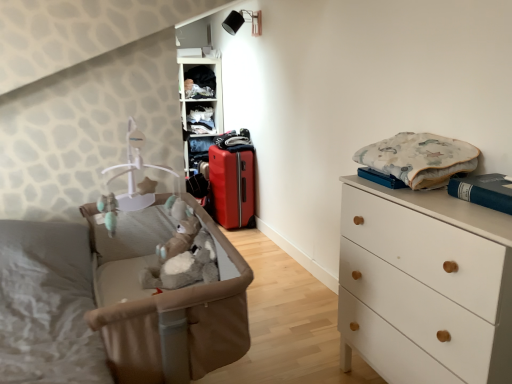
Question: Does point (181, 61) appear closer or farther from the camera than point (133, 142)?

Choices:
 (A) farther
 (B) closer

Answer: (A)

Question: From a real-world perspective, is matte plastic shelf at upper center, which is the second shelf in top-to-bottom order, positioned above or below brown fabric infant bed at left?

Choices:
 (A) above
 (B) below

Answer: (A)

Question: Estimate the real-world distances between objects in this image. Which object is farther from the white matte chest of drawers at right?

Choices:
 (A) matte plastic shelves at upper center, the 1th shelf positioned from the top
 (B) brown fabric infant bed at left
 (C) fluffy cotton blanket at upper right, the 2th clothing in the left-to-right sequence
 (D) dark blue fabric at upper center, acting as the second clothing starting from the right
 (E) matte red suitcase at center

Answer: (D)

Question: Considering the real-world distances, which object is closest to the matte plastic shelves at upper center, which is the second shelf from bottom to top?

Choices:
 (A) matte plastic shelf at upper center, which is the second shelf in top-to-bottom order
 (B) brown fabric infant bed at left
 (C) dark blue fabric at upper center, which is counted as the first clothing, starting from the back
 (D) white matte chest of drawers at right
 (E) matte red suitcase at center

Answer: (A)